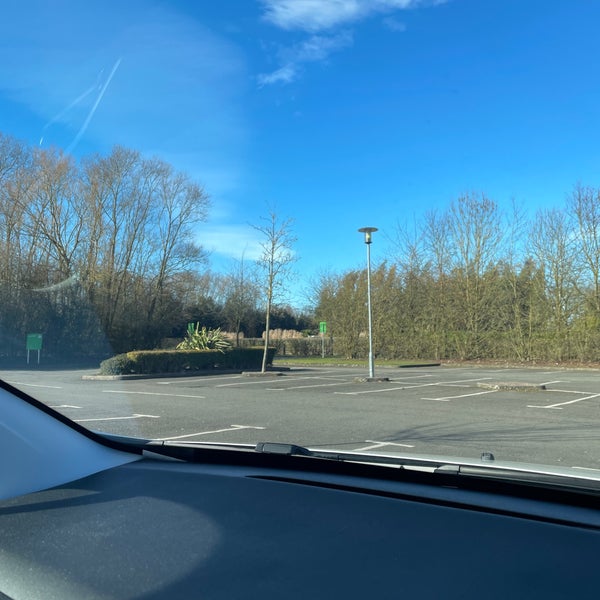
This screenshot has height=600, width=600. What are the coordinates of `looks like a large plant` in the screenshot? It's located at (212, 337).